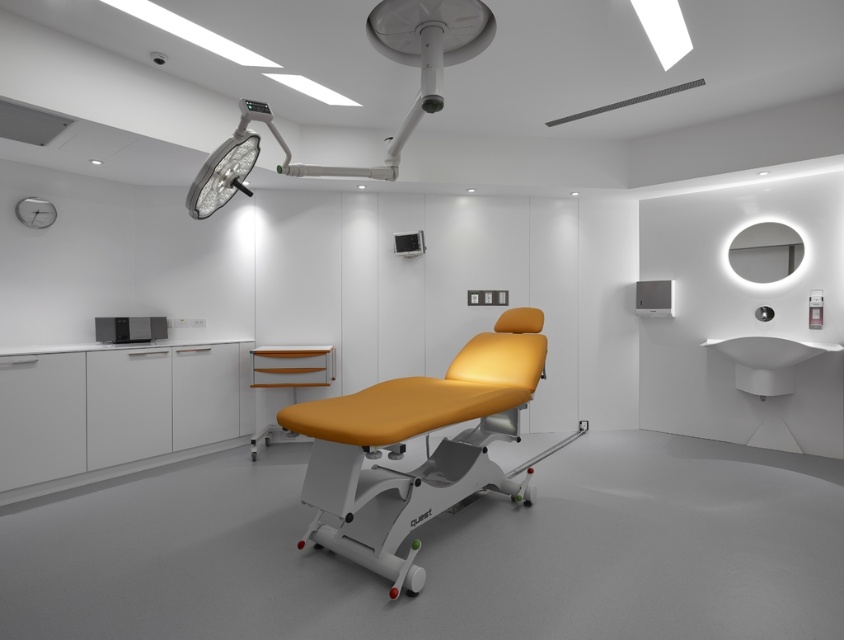
Question: Can you confirm if matte orange leather chair at center is positioned below matte white surgical light at upper center?

Choices:
 (A) yes
 (B) no

Answer: (A)

Question: Which point appears closest to the camera in this image?

Choices:
 (A) 371,177
 (B) 160,332

Answer: (A)

Question: In this image, where is matte orange leather chair at center located relative to matte black monitor at lower left?

Choices:
 (A) above
 (B) below

Answer: (B)

Question: Can you confirm if matte white surgical light at upper center is positioned to the left of matte black monitor at lower left?

Choices:
 (A) yes
 (B) no

Answer: (B)

Question: Which point is closer to the camera taking this photo?

Choices:
 (A) (479, 10)
 (B) (133, 330)

Answer: (A)

Question: Among these objects, which one is farthest from the camera?

Choices:
 (A) matte white surgical light at upper center
 (B) matte black monitor at lower left

Answer: (B)